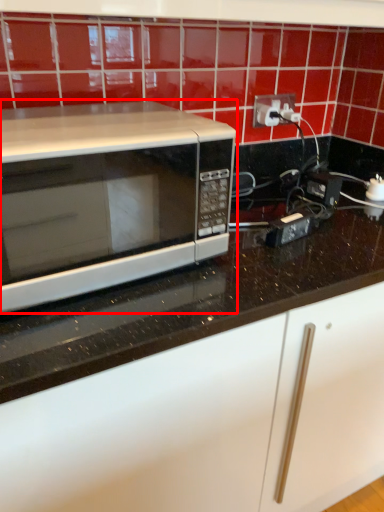
Question: From the image's perspective, where is microwave oven (annotated by the red box) located relative to electric outlet?

Choices:
 (A) above
 (B) below

Answer: (B)